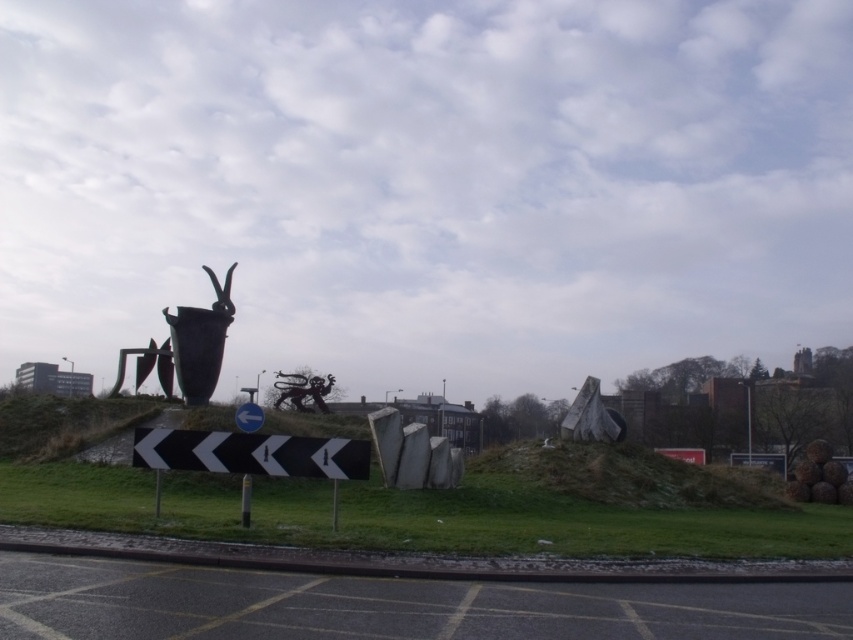
Based on the photo, does green grass at lower center appear under polished bronze vase at center?

Yes.

Who is taller, green grass at lower center or polished bronze vase at center?

Standing taller between the two is green grass at lower center.

What do you see at coordinates (410, 515) in the screenshot?
I see `green grass at lower center` at bounding box center [410, 515].

The image size is (853, 640). I want to click on green grass at lower center, so (x=410, y=515).

Between point (265, 525) and point (375, 422), which one is positioned behind?

The point (375, 422) is more distant.

Is green grass at lower center above smooth concrete slabs at center?

Correct, green grass at lower center is located above smooth concrete slabs at center.

Is point (91, 477) closer to camera compared to point (387, 476)?

No, it is not.

You are a GUI agent. You are given a task and a screenshot of the screen. Output one action in this format:
    pyautogui.click(x=<x>, y=<y>)
    Task: Click on the green grass at lower center
    
    Given the screenshot: What is the action you would take?
    pyautogui.click(x=410, y=515)

The height and width of the screenshot is (640, 853). Identify the location of polished bronze vase at center. coord(189,346).

Can you confirm if polished bronze vase at center is thinner than smooth concrete slabs at center?

Indeed, polished bronze vase at center has a lesser width compared to smooth concrete slabs at center.

At what (x,y) coordinates should I click in order to perform the action: click on polished bronze vase at center. Please return your answer as a coordinate pair (x, y). The height and width of the screenshot is (640, 853). Looking at the image, I should click on (189, 346).

You are a GUI agent. You are given a task and a screenshot of the screen. Output one action in this format:
    pyautogui.click(x=<x>, y=<y>)
    Task: Click on the polished bronze vase at center
    The image size is (853, 640).
    Given the screenshot: What is the action you would take?
    pyautogui.click(x=189, y=346)